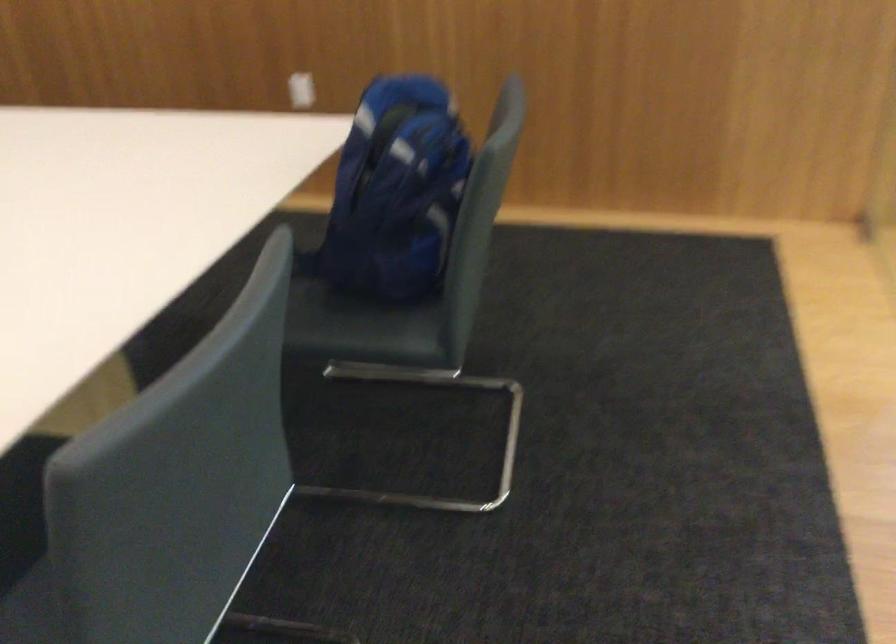
Find the location of a particular element. blue backpack is located at coordinates (395, 192).